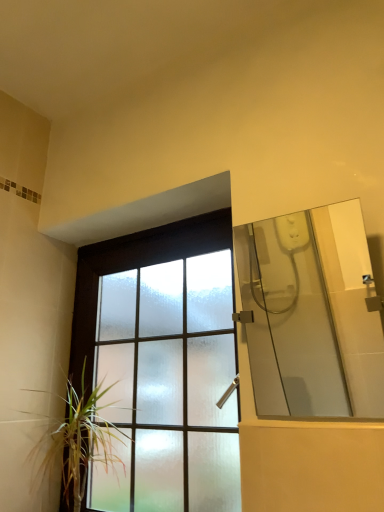
Question: Can you confirm if frosted glass window at center is positioned to the left of green leafy plant at lower left?

Choices:
 (A) no
 (B) yes

Answer: (A)

Question: Can you confirm if frosted glass window at center is wider than green leafy plant at lower left?

Choices:
 (A) yes
 (B) no

Answer: (B)

Question: Does frosted glass window at center have a lesser height compared to green leafy plant at lower left?

Choices:
 (A) yes
 (B) no

Answer: (B)

Question: Is frosted glass window at center oriented towards green leafy plant at lower left?

Choices:
 (A) no
 (B) yes

Answer: (B)

Question: Is frosted glass window at center turned away from green leafy plant at lower left?

Choices:
 (A) yes
 (B) no

Answer: (A)

Question: Does point (304, 375) appear closer or farther from the camera than point (39, 391)?

Choices:
 (A) farther
 (B) closer

Answer: (A)

Question: From the image's perspective, is transparent glass shower door at right located above or below green leafy plant at lower left?

Choices:
 (A) above
 (B) below

Answer: (A)

Question: Considering the relative positions of transparent glass shower door at right and green leafy plant at lower left in the image provided, is transparent glass shower door at right to the left or to the right of green leafy plant at lower left?

Choices:
 (A) left
 (B) right

Answer: (B)

Question: In terms of size, does transparent glass shower door at right appear bigger or smaller than green leafy plant at lower left?

Choices:
 (A) big
 (B) small

Answer: (B)

Question: Is green leafy plant at lower left taller or shorter than frosted glass window at center?

Choices:
 (A) short
 (B) tall

Answer: (A)

Question: From the image's perspective, relative to frosted glass window at center, is green leafy plant at lower left above or below?

Choices:
 (A) below
 (B) above

Answer: (A)

Question: Is green leafy plant at lower left wider or thinner than frosted glass window at center?

Choices:
 (A) wide
 (B) thin

Answer: (A)

Question: Is green leafy plant at lower left spatially inside frosted glass window at center, or outside of it?

Choices:
 (A) inside
 (B) outside

Answer: (A)

Question: Would you say transparent glass shower door at right is inside or outside frosted glass window at center?

Choices:
 (A) inside
 (B) outside

Answer: (B)

Question: Based on their sizes in the image, would you say transparent glass shower door at right is bigger or smaller than frosted glass window at center?

Choices:
 (A) big
 (B) small

Answer: (B)